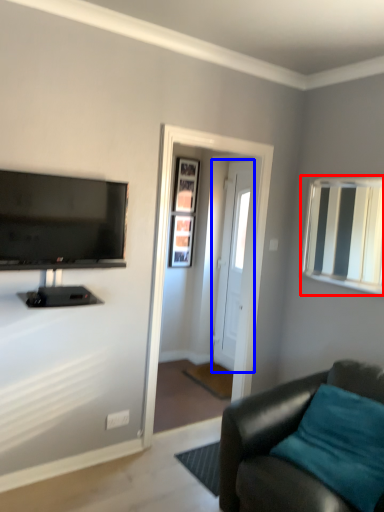
Question: Which point is closer to the camera, mirror (highlighted by a red box) or door (highlighted by a blue box)?

Choices:
 (A) mirror
 (B) door

Answer: (A)